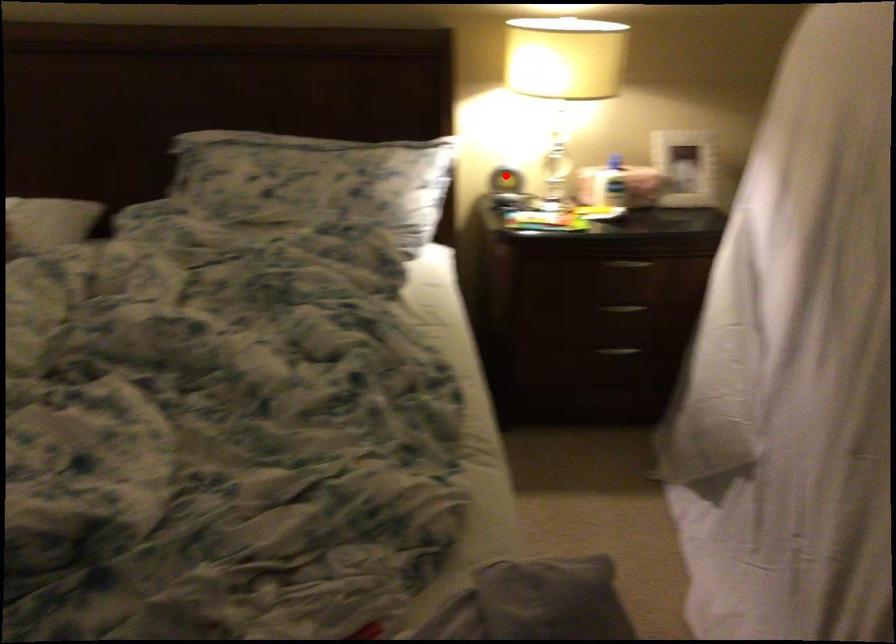
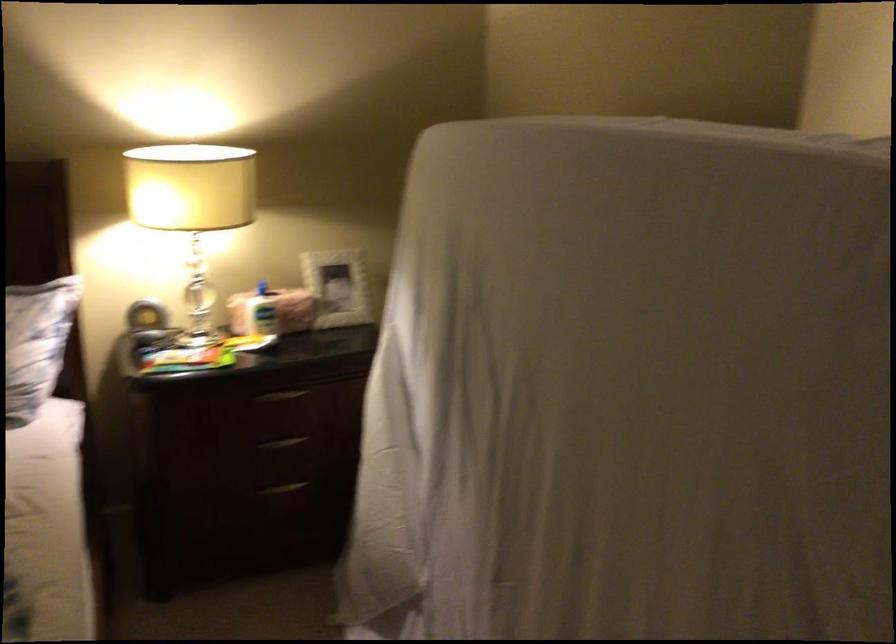
Locate, in the second image, the point that corresponds to the highlighted location in the first image.

(145, 316)